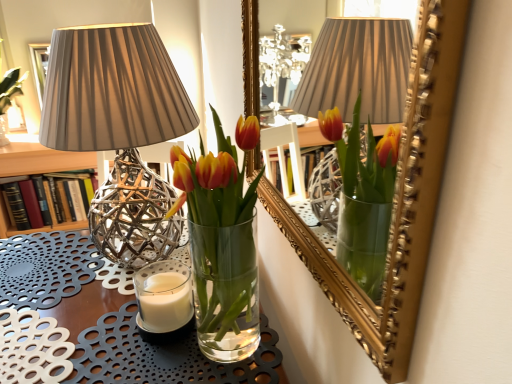
Question: Looking at their shapes, would you say translucent glass vase at center is wider or thinner than hardcover book at left?

Choices:
 (A) thin
 (B) wide

Answer: (A)

Question: In terms of height, does translucent glass vase at center look taller or shorter compared to hardcover book at left?

Choices:
 (A) tall
 (B) short

Answer: (A)

Question: Estimate the real-world distances between objects in this image. Which object is farther from the hardcover book at left?

Choices:
 (A) white wax candle at lower left
 (B) matte silver lamp at left
 (C) clear glass vase at center
 (D) translucent glass vase at center

Answer: (D)

Question: Which is nearer to the matte silver lamp at left?

Choices:
 (A) clear glass vase at center
 (B) translucent glass vase at center
 (C) hardcover book at left
 (D) white wax candle at lower left

Answer: (B)